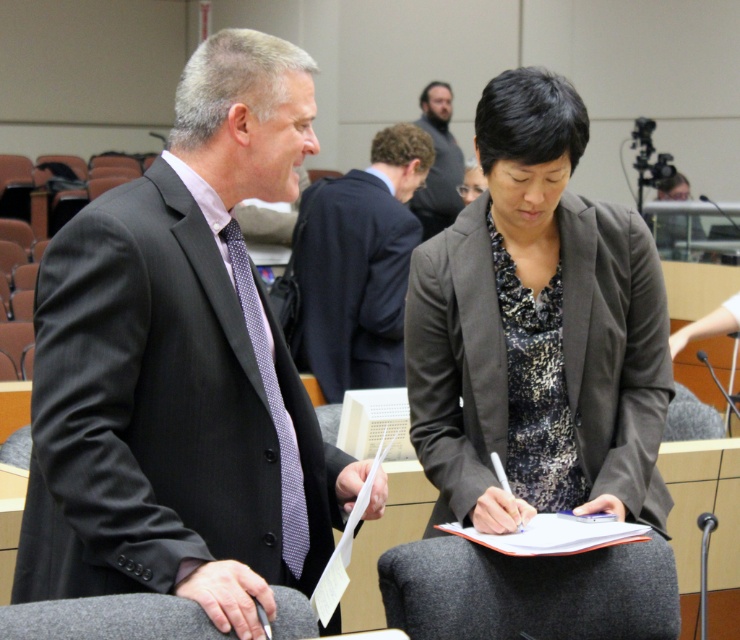
Is dark gray textured blazer at center smaller than dark brown hair at center?

Yes, dark gray textured blazer at center is smaller than dark brown hair at center.

Who is positioned more to the left, dark gray textured blazer at center or dark brown hair at center?

Positioned to the left is dark gray textured blazer at center.

Is point (414, 348) less distant than point (434, 188)?

Yes, point (414, 348) is closer to viewer.

This screenshot has height=640, width=740. I want to click on dark gray textured blazer at center, so click(454, 358).

Is dark brown hair at center above matte black suit at center?

Yes, dark brown hair at center is above matte black suit at center.

Is point (444, 90) closer to camera compared to point (465, 161)?

That is False.

Is point (434, 218) positioned behind point (467, 193)?

Yes.

Where is `dark brown hair at center`? dark brown hair at center is located at coordinates (437, 163).

Is matte black suit at left in front of matte black suit at center?

Yes, matte black suit at left is closer to the viewer.

This screenshot has width=740, height=640. Describe the element at coordinates (181, 369) in the screenshot. I see `matte black suit at left` at that location.

The image size is (740, 640). Identify the location of matte black suit at left. (181, 369).